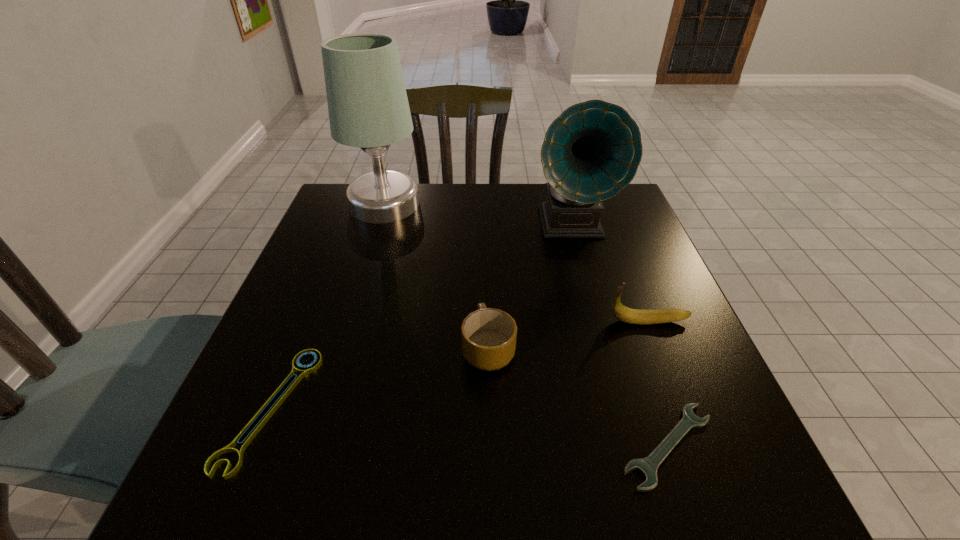
The image size is (960, 540). In order to click on blank space located 0.230m at the stem of the fourth shortest object in this screenshot , I will do `click(497, 321)`.

You are a GUI agent. You are given a task and a screenshot of the screen. Output one action in this format:
    pyautogui.click(x=<x>, y=<y>)
    Task: Click on the blank space located 0.200m at the stem of the fourth shortest object
    The height and width of the screenshot is (540, 960).
    Given the screenshot: What is the action you would take?
    pyautogui.click(x=512, y=321)

This screenshot has width=960, height=540. Find the location of `free space located on the side with the handle of the third object from left to right`. free space located on the side with the handle of the third object from left to right is located at coordinates (486, 220).

Image resolution: width=960 pixels, height=540 pixels. Identify the location of free location located on the side with the handle of the third object from left to right. (488, 284).

The width and height of the screenshot is (960, 540). What are the coordinates of `vacant area situated 0.380m on the side with the handle of the third object from left to right` in the screenshot? It's located at (486, 220).

What are the coordinates of `vacant area situated on the back of the left wrench` in the screenshot? It's located at pos(342,234).

Where is `vacant space located 0.180m on the back of the right wrench`? The width and height of the screenshot is (960, 540). vacant space located 0.180m on the back of the right wrench is located at coordinates (629, 328).

Find the location of a particular element. This screenshot has height=540, width=960. lampshade situated at the far edge is located at coordinates (368, 107).

The image size is (960, 540). I want to click on phonograph_record that is at the far edge, so click(591, 151).

Locate an element on the screen. The image size is (960, 540). lampshade that is at the left edge is located at coordinates (368, 107).